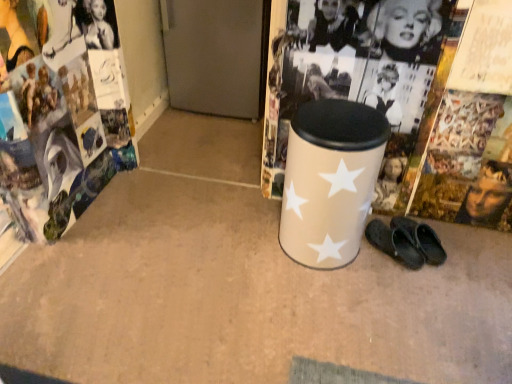
Image resolution: width=512 pixels, height=384 pixels. I want to click on blank space situated above beige matte waste container at center (from a real-world perspective), so click(x=350, y=119).